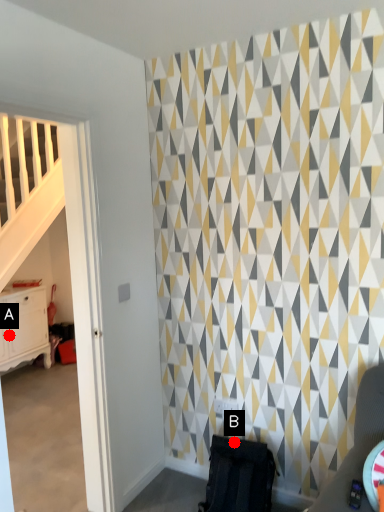
Question: Two points are circled on the image, labeled by A and B beside each circle. Which point is further to the camera?

Choices:
 (A) A is further
 (B) B is further

Answer: (A)